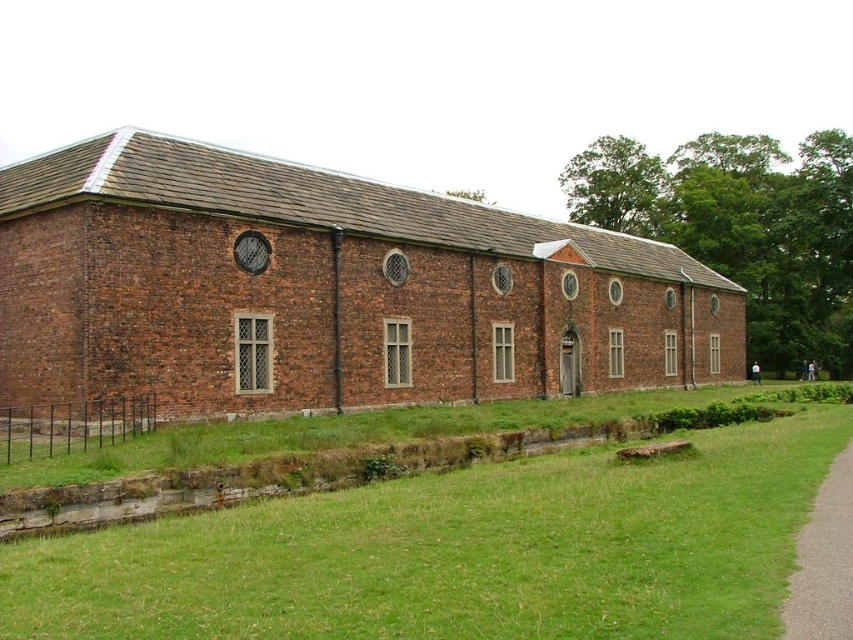
Is point (151, 282) positioned before point (61, 545)?

No, (151, 282) is further to viewer.

Is point (506, 292) more distant than point (397, 593)?

That is True.

You are a GUI agent. You are given a task and a screenshot of the screen. Output one action in this format:
    pyautogui.click(x=<x>, y=<y>)
    Task: Click on the brown brick building at center
    This screenshot has width=853, height=640.
    Given the screenshot: What is the action you would take?
    pyautogui.click(x=325, y=289)

Does brown brick building at center have a smaller size compared to gray asphalt path at lower right?

No, brown brick building at center is not smaller than gray asphalt path at lower right.

Where is `brown brick building at center`? The image size is (853, 640). brown brick building at center is located at coordinates (325, 289).

Between point (605, 314) and point (850, 465), which one is positioned in front?

Positioned in front is point (850, 465).

You are a GUI agent. You are given a task and a screenshot of the screen. Output one action in this format:
    pyautogui.click(x=<x>, y=<y>)
    Task: Click on the brown brick building at center
    The height and width of the screenshot is (640, 853).
    Given the screenshot: What is the action you would take?
    pyautogui.click(x=325, y=289)

Is green grass at lower center shorter than gray asphalt path at lower right?

No, green grass at lower center is not shorter than gray asphalt path at lower right.

Which of these two, green grass at lower center or gray asphalt path at lower right, stands shorter?

gray asphalt path at lower right is shorter.

Is point (498, 481) less distant than point (784, 634)?

That is False.

Find the location of `green grass at lower center`. green grass at lower center is located at coordinates (x=459, y=552).